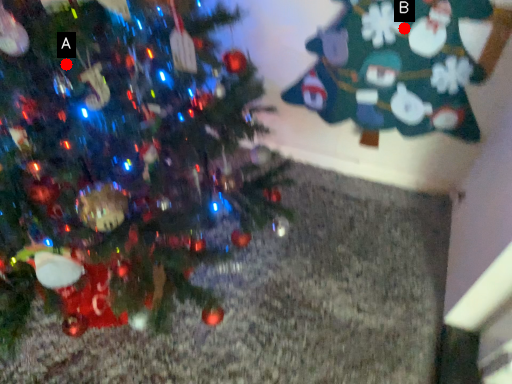
Question: Two points are circled on the image, labeled by A and B beside each circle. Which point is further to the camera?

Choices:
 (A) A is further
 (B) B is further

Answer: (B)